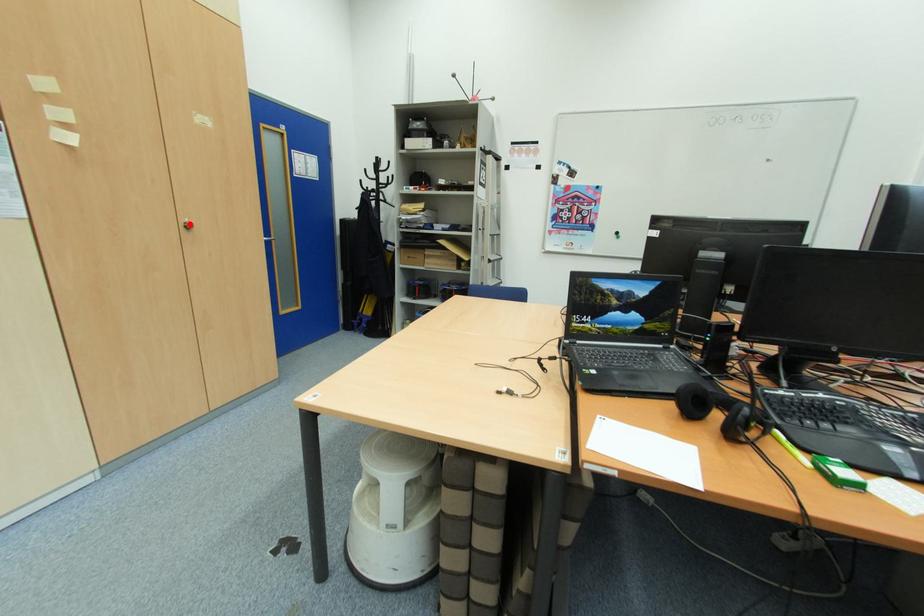
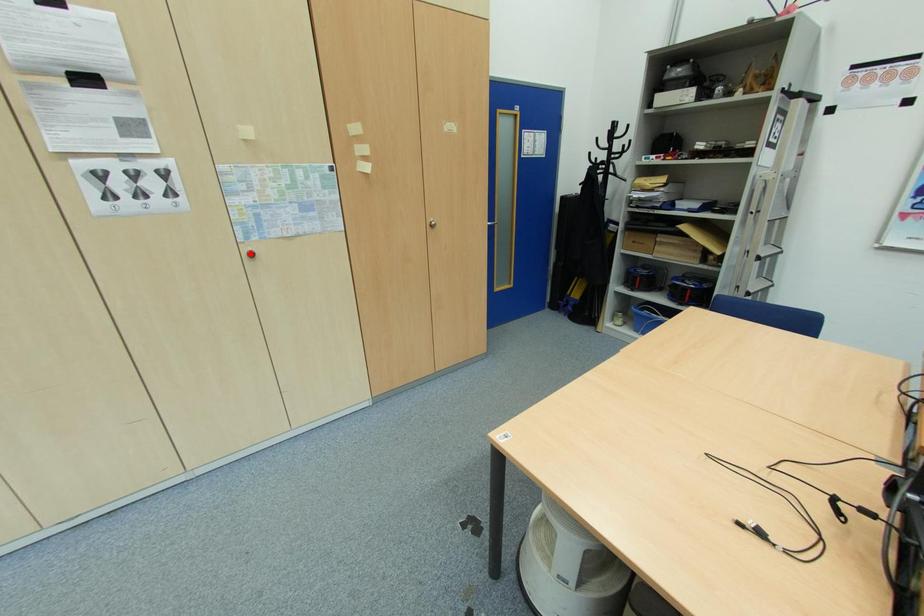
I am providing you with two images of the same scene from different viewpoints. A red point is marked on the first image and another point is marked on the second image. Is the marked point in image1 the same physical position as the marked point in image2?

No